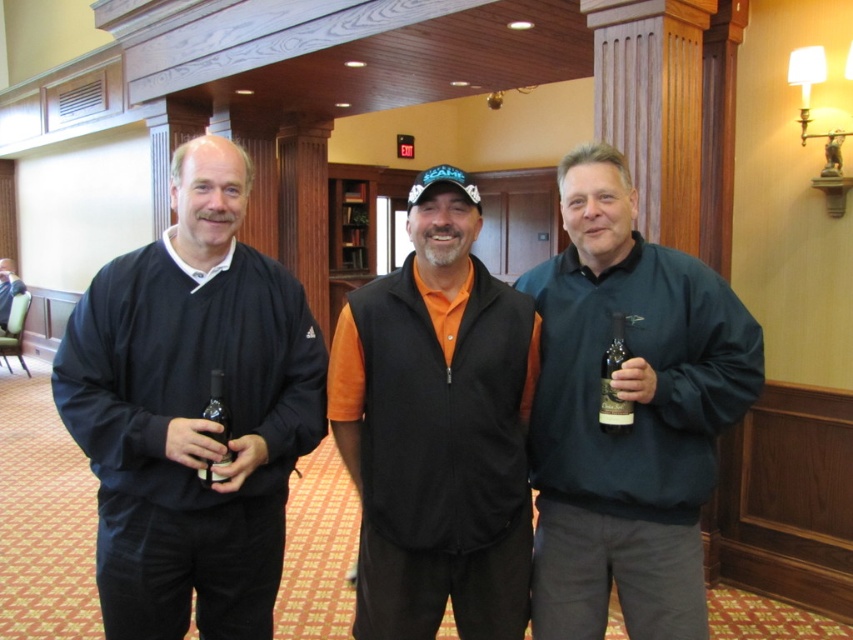
Question: Can you confirm if black matte sweater at left is positioned to the left of translucent glass bottle at center?

Choices:
 (A) yes
 (B) no

Answer: (A)

Question: Does orange fleece vest at center have a lesser width compared to shiny gold champagne at center?

Choices:
 (A) no
 (B) yes

Answer: (A)

Question: Which object is the farthest from the shiny gold champagne at center?

Choices:
 (A) black matte sweater at left
 (B) orange fleece vest at center

Answer: (A)

Question: Can you confirm if black matte sweater at left is bigger than shiny gold champagne at center?

Choices:
 (A) yes
 (B) no

Answer: (A)

Question: Which point is closer to the camera taking this photo?

Choices:
 (A) (483, 316)
 (B) (206, 476)

Answer: (B)

Question: Which object is positioned farthest from the black matte sweater at left?

Choices:
 (A) shiny gold champagne at center
 (B) dark green sweater at center
 (C) translucent glass bottle at center
 (D) orange fleece vest at center

Answer: (A)